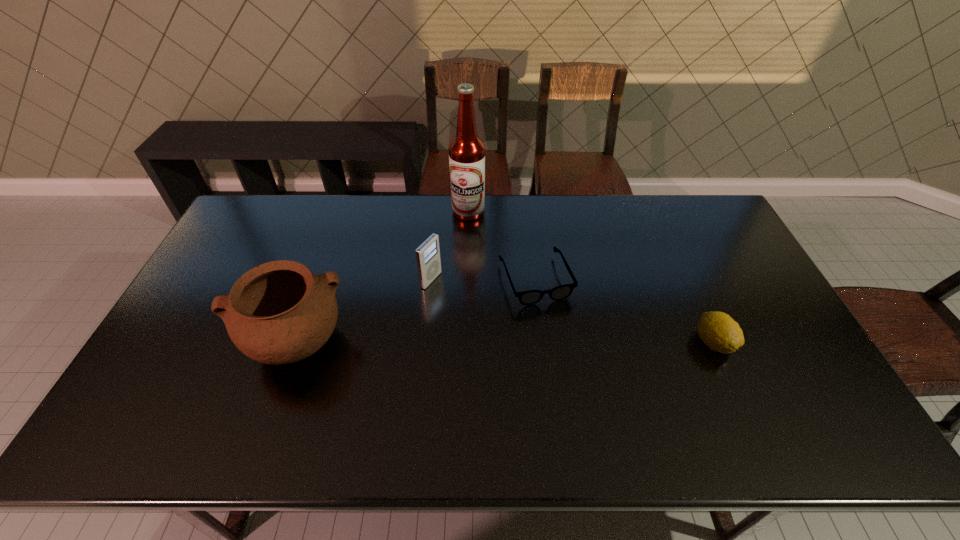
This screenshot has height=540, width=960. Identify the location of free space that satisfies the following two spatial constraints: 1. on the back side of the fourth object from right to left; 2. on the right side of the pottery. (317, 280).